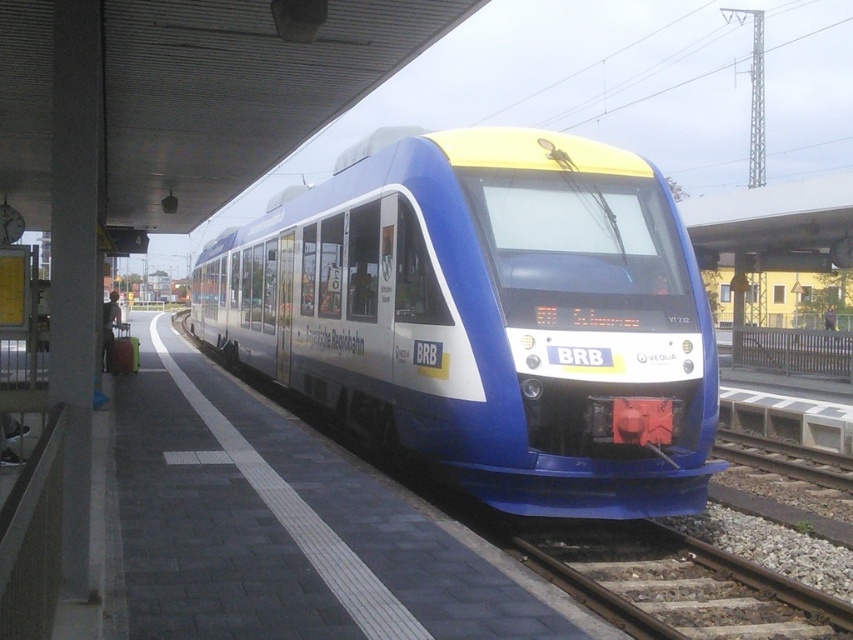
Consider the image. You are a passenger waiting at the station platform. You notice two trains labeled as blue glossy train at center and matte blue train at center. Which one is positioned higher relative to the other?

The blue glossy train at center is located above the matte blue train at center, so it is positioned higher.

You are a passenger waiting at the train station. You see the blue glossy train at center and the brown wooden train track at lower right. Which object is located to the left of the other?

The blue glossy train at center is positioned on the left side of brown wooden train track at lower right.

You are a passenger waiting at the station platform. You see two trains, the blue glossy train at center and the matte blue train at center. Which one is taller?

The blue glossy train at center is taller than the matte blue train at center.